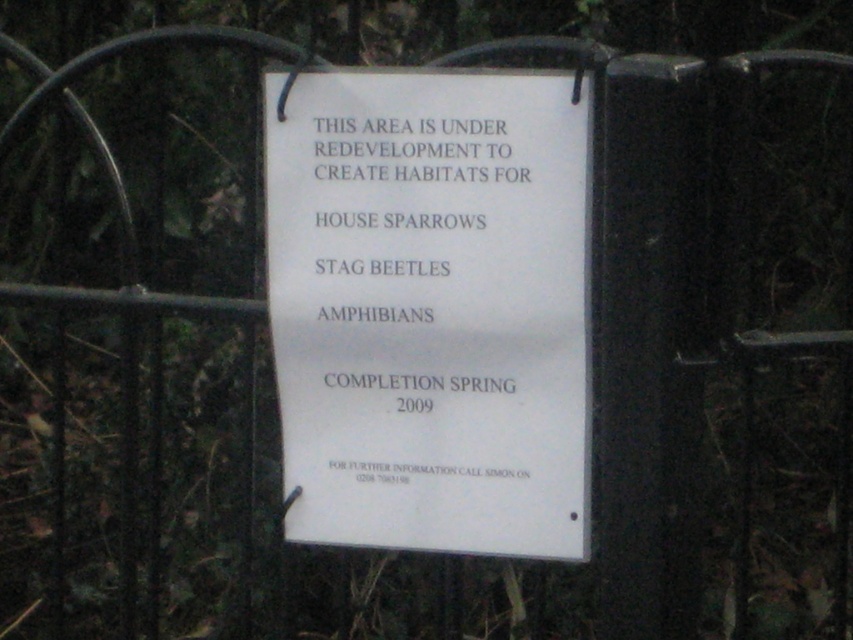
Based on the photo, is white paper sign at center shorter than white paper at center?

In fact, white paper sign at center may be taller than white paper at center.

Is white paper sign at center below white paper at center?

Correct, white paper sign at center is located below white paper at center.

Between point (456, 387) and point (427, 173), which one is positioned behind?

Point (456, 387)

Identify the location of white paper sign at center. The height and width of the screenshot is (640, 853). (431, 308).